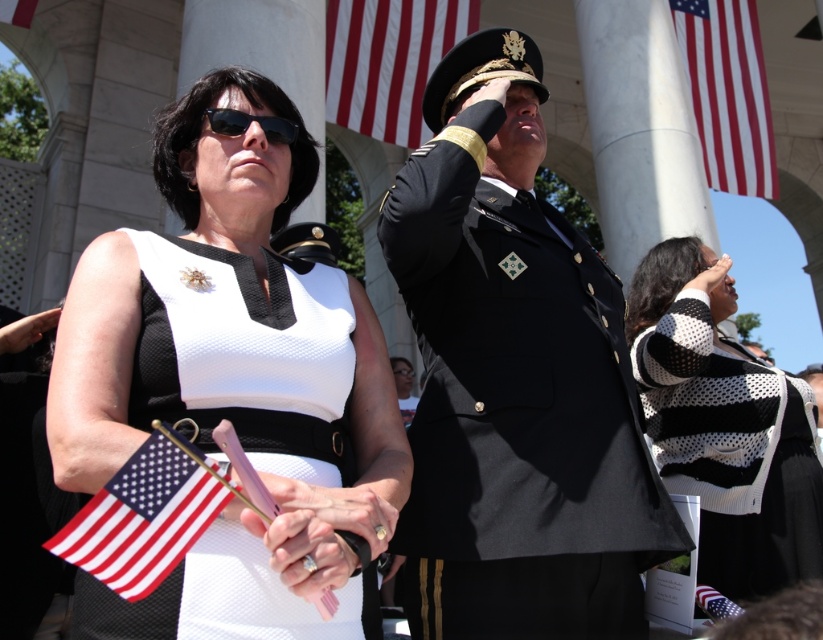
Can you confirm if shiny black uniform at center is positioned below matte black uniform at center?

No, shiny black uniform at center is not below matte black uniform at center.

You are a GUI agent. You are given a task and a screenshot of the screen. Output one action in this format:
    pyautogui.click(x=<x>, y=<y>)
    Task: Click on the shiny black uniform at center
    The image size is (823, 640).
    Given the screenshot: What is the action you would take?
    coord(514,380)

Locate an element on the screen. shiny black uniform at center is located at coordinates (514, 380).

Is black and white knitted sweater at center positioned behind red/white striped flag at upper center?

No.

Does point (768, 552) come in front of point (414, 28)?

Yes, point (768, 552) is closer to viewer.

Who is more forward, (630, 342) or (428, 8)?

Point (630, 342)

Where is `black and white knitted sweater at center`? The image size is (823, 640). black and white knitted sweater at center is located at coordinates (724, 426).

Which is in front, point (729, 122) or point (272, 134)?

Point (272, 134) is in front.

Is point (775, 195) less distant than point (287, 122)?

That is False.

Is point (760, 48) positioned before point (245, 116)?

No, it is behind (245, 116).

At what (x,y) coordinates should I click in order to perform the action: click on red fabric flag at upper right. Please return your answer as a coordinate pair (x, y). Looking at the image, I should click on (728, 93).